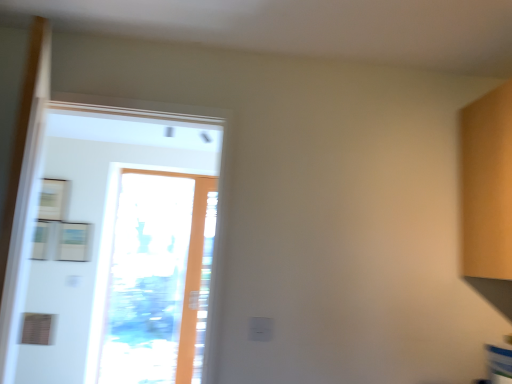
Question: Should I look upward or downward to see transparent glass door at center?

Choices:
 (A) down
 (B) up

Answer: (A)

Question: Is transparent glass screen door at left positioned in front of transparent glass door at center?

Choices:
 (A) yes
 (B) no

Answer: (A)

Question: Would you say transparent glass screen door at left is outside transparent glass door at center?

Choices:
 (A) yes
 (B) no

Answer: (A)

Question: Is transparent glass screen door at left directly adjacent to transparent glass door at center?

Choices:
 (A) no
 (B) yes

Answer: (B)

Question: Can you confirm if transparent glass screen door at left is wider than transparent glass door at center?

Choices:
 (A) no
 (B) yes

Answer: (B)

Question: Considering the relative positions of transparent glass screen door at left and transparent glass door at center in the image provided, is transparent glass screen door at left to the left of transparent glass door at center from the viewer's perspective?

Choices:
 (A) yes
 (B) no

Answer: (B)

Question: Can you confirm if transparent glass screen door at left is thinner than transparent glass door at center?

Choices:
 (A) no
 (B) yes

Answer: (A)

Question: Would you say transparent glass screen door at left is part of transparent glass door at center's contents?

Choices:
 (A) yes
 (B) no

Answer: (B)

Question: Would you say transparent glass door at center is outside transparent glass screen door at left?

Choices:
 (A) yes
 (B) no

Answer: (A)

Question: Is transparent glass door at center oriented away from transparent glass screen door at left?

Choices:
 (A) yes
 (B) no

Answer: (B)

Question: From the image's perspective, is transparent glass door at center on top of transparent glass screen door at left?

Choices:
 (A) yes
 (B) no

Answer: (B)

Question: From the image's perspective, is transparent glass door at center under transparent glass screen door at left?

Choices:
 (A) no
 (B) yes

Answer: (B)

Question: Considering the relative sizes of transparent glass door at center and transparent glass screen door at left in the image provided, is transparent glass door at center bigger than transparent glass screen door at left?

Choices:
 (A) no
 (B) yes

Answer: (A)

Question: Is transparent glass door at center to the left or to the right of transparent glass screen door at left in the image?

Choices:
 (A) left
 (B) right

Answer: (A)